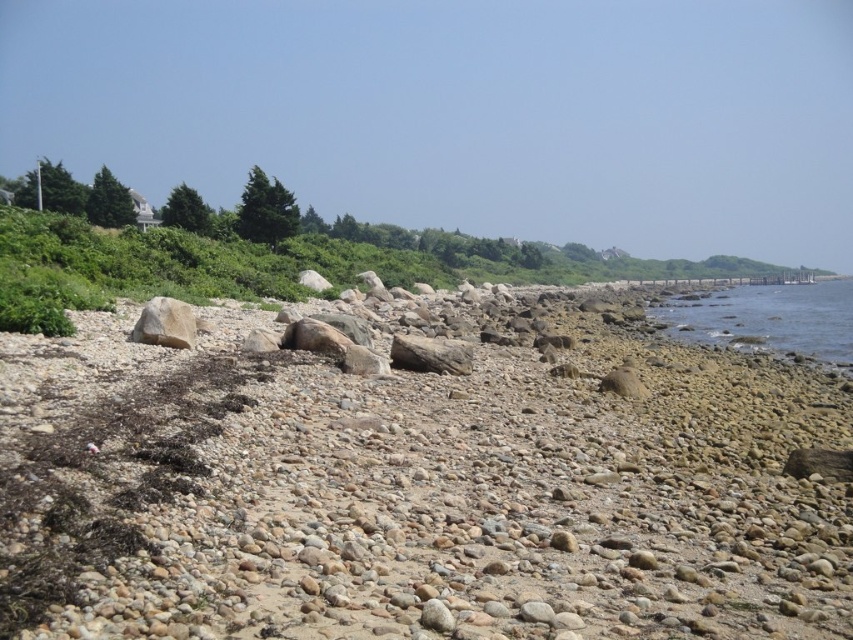
You are standing at the edge of the rocky beach looking towards the vegetation. There are two points marked on the image, point A at coordinates point A is point (534, 417) and point B at coordinates point B is point (817, 317). Which point is closer to you?

Point A at coordinates point A is point (534, 417) is closer to you because it is in front of point B at coordinates point B is point (817, 317).